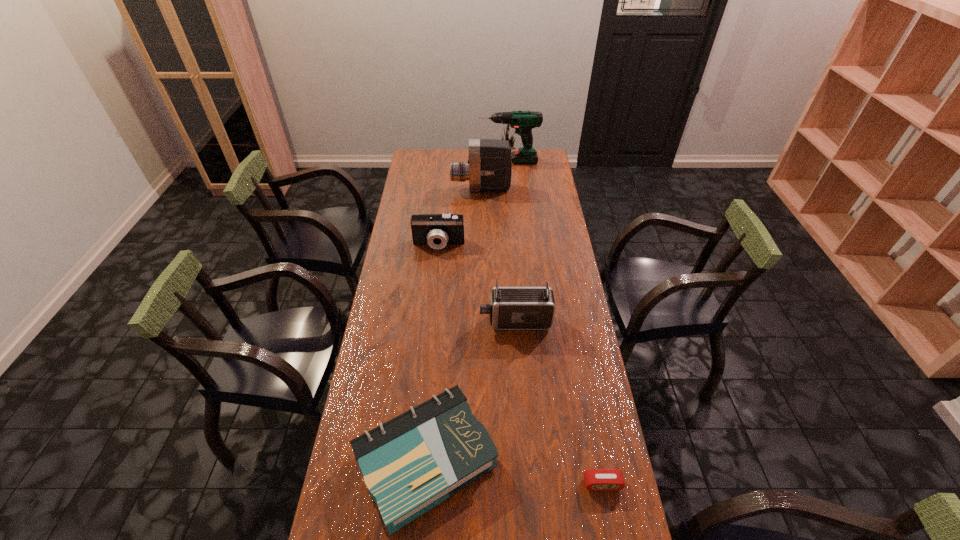
Image resolution: width=960 pixels, height=540 pixels. In order to click on vacant region located 0.070m on the front-facing side of the alarm clock in this screenshot , I will do coord(609,520).

You are a GUI agent. You are given a task and a screenshot of the screen. Output one action in this format:
    pyautogui.click(x=<x>, y=<y>)
    Task: Click on the object present at the far edge
    
    Given the screenshot: What is the action you would take?
    pyautogui.click(x=523, y=121)

Locate an element on the screen. camcorder present at the left edge is located at coordinates (437, 230).

Identify the location of paperback book that is positioned at the left edge. This screenshot has width=960, height=540. (410, 464).

The image size is (960, 540). Identify the location of drill that is positioned at the right edge. (523, 121).

At what (x,y) coordinates should I click in order to perform the action: click on camcorder located at the right edge. Please return your answer as a coordinate pair (x, y). The width and height of the screenshot is (960, 540). Looking at the image, I should click on (511, 308).

Image resolution: width=960 pixels, height=540 pixels. I want to click on alarm clock that is at the right edge, so click(x=595, y=479).

Locate an element on the screen. The image size is (960, 540). object present at the far right corner is located at coordinates (523, 121).

Identify the location of vacant position at the far edge of the desktop. (444, 163).

Find the location of a particular element. The height and width of the screenshot is (540, 960). free space at the left edge of the desktop is located at coordinates (340, 501).